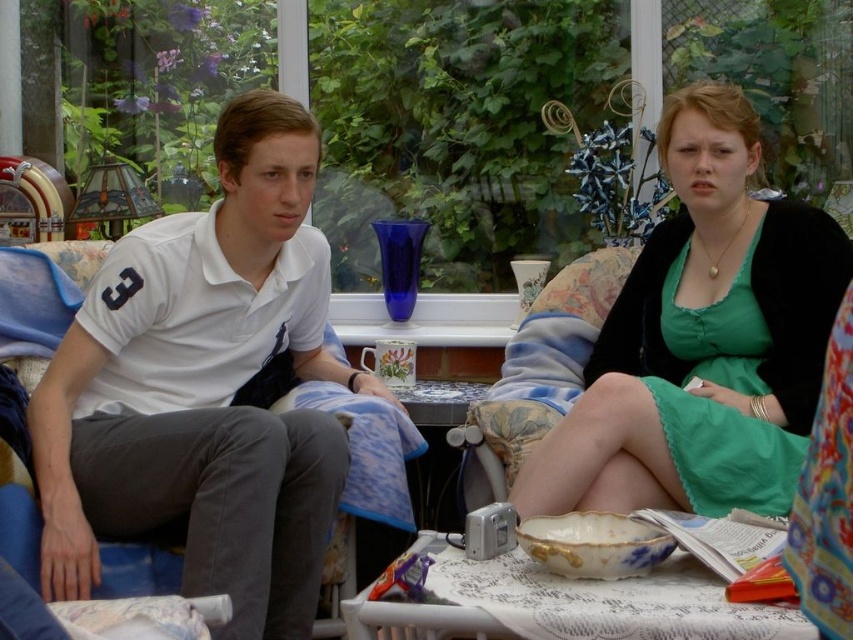
Question: Among these points, which one is farthest from the camera?

Choices:
 (A) (355, 602)
 (B) (636, 397)
 (C) (143, 417)

Answer: (C)

Question: Which point is farther to the camera?

Choices:
 (A) green satin dress at center
 (B) porcelain bowl at lower center

Answer: (A)

Question: Observing the image, what is the correct spatial positioning of green satin dress at center in reference to porcelain bowl at lower center?

Choices:
 (A) right
 (B) left

Answer: (A)

Question: Does green satin dress at center have a smaller size compared to porcelain bowl at lower center?

Choices:
 (A) yes
 (B) no

Answer: (B)

Question: Can you confirm if white cotton polo shirt at left is thinner than porcelain bowl at lower center?

Choices:
 (A) no
 (B) yes

Answer: (A)

Question: Among these objects, which one is farthest from the camera?

Choices:
 (A) porcelain bowl at lower center
 (B) green satin dress at center
 (C) white cotton polo shirt at left

Answer: (B)